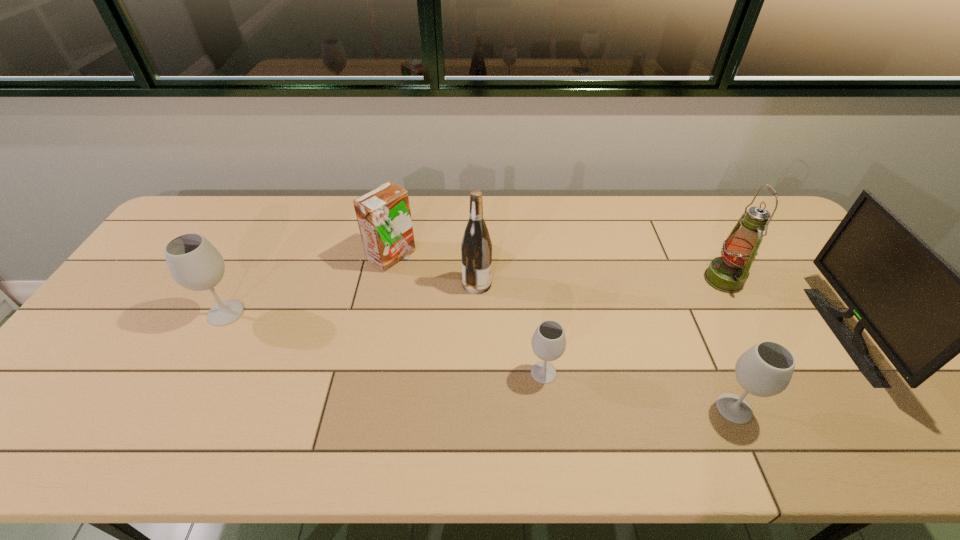
I want to click on object at the right edge, so click(x=921, y=312).

Find the location of a particular element. This screenshot has height=540, width=960. object situated at the near right corner is located at coordinates (921, 312).

In the image, there is a desktop. Where is `vacant space at the far edge`? This screenshot has height=540, width=960. vacant space at the far edge is located at coordinates (528, 222).

Identify the location of free space at the near edge of the desktop. This screenshot has width=960, height=540. (709, 399).

Locate an element on the screen. vacant space at the left edge of the desktop is located at coordinates (140, 336).

Identify the location of vacant space at the right edge of the desktop. (777, 264).

Find the location of `free space between the oil lamp and the sixth object from right to left`. free space between the oil lamp and the sixth object from right to left is located at coordinates (558, 268).

The width and height of the screenshot is (960, 540). I want to click on empty space between the oil lamp and the fifth object from left to right, so click(x=729, y=344).

Locate an element on the screen. free spot between the fourth object from right to left and the sixth object from right to left is located at coordinates (468, 315).

You are a GUI agent. You are given a task and a screenshot of the screen. Output one action in this format:
    pyautogui.click(x=<x>, y=<y>)
    Task: Click on the free area in between the second tallest wineglass and the fifth object from right to left
    The image size is (960, 540).
    Given the screenshot: What is the action you would take?
    pyautogui.click(x=606, y=346)